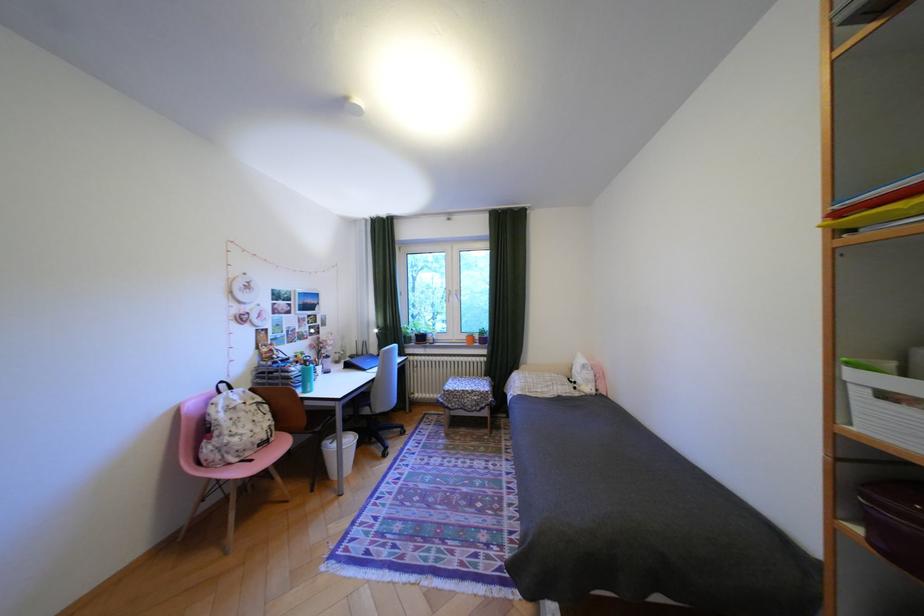
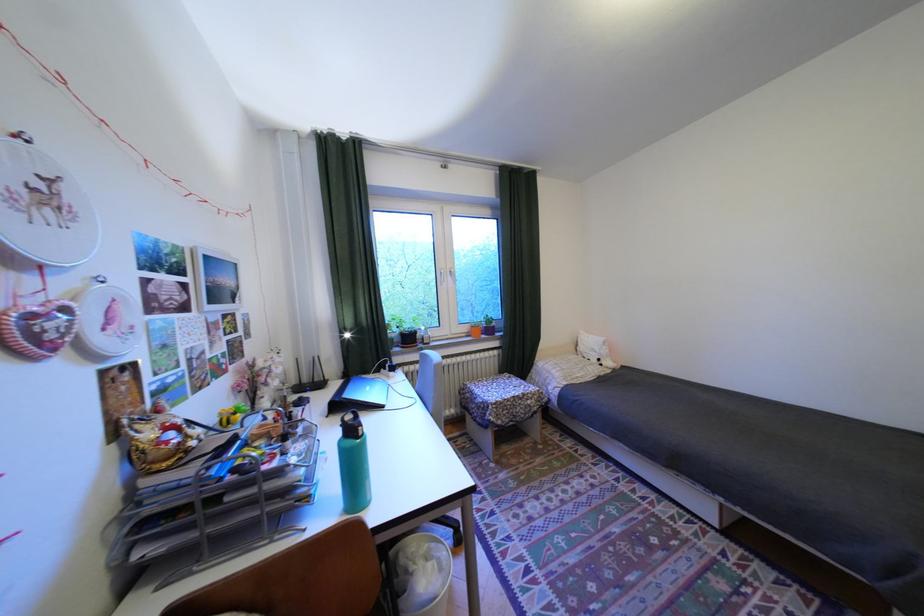
Where in the second image is the point corresponding to (x=260, y=286) from the first image?

(58, 197)